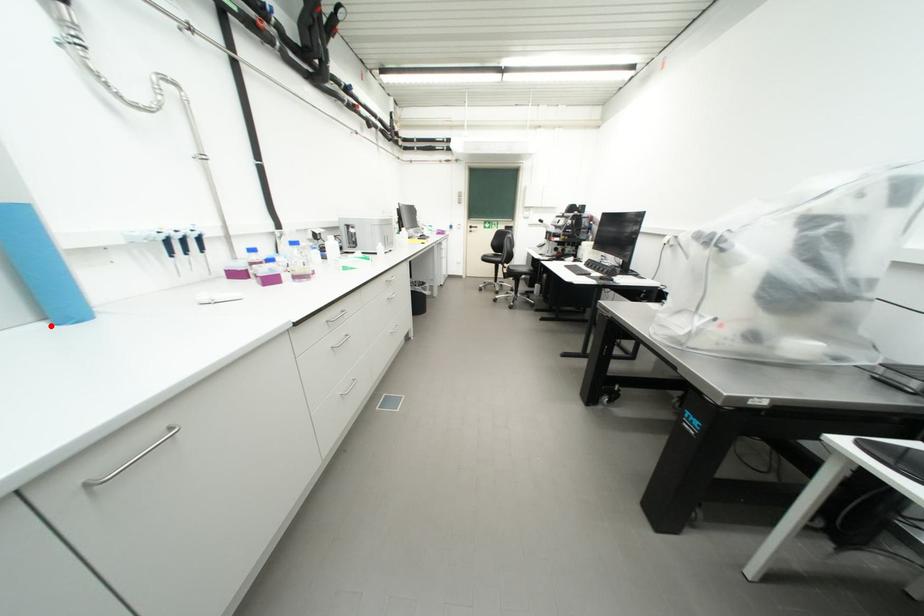
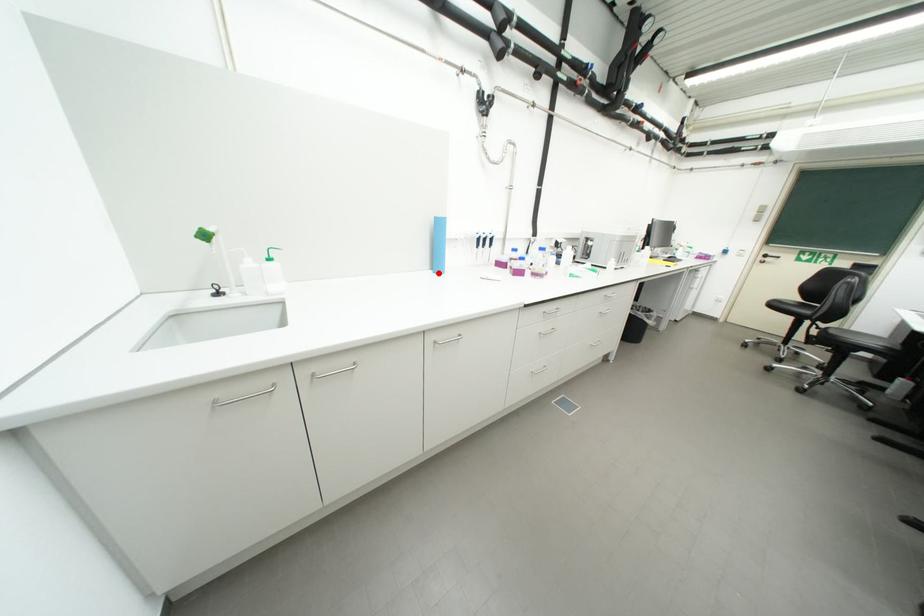
I am providing you with two images of the same scene from different viewpoints. A red point is marked on the first image and another point is marked on the second image. Do the highlighted points in image1 and image2 indicate the same real-world spot?

Yes